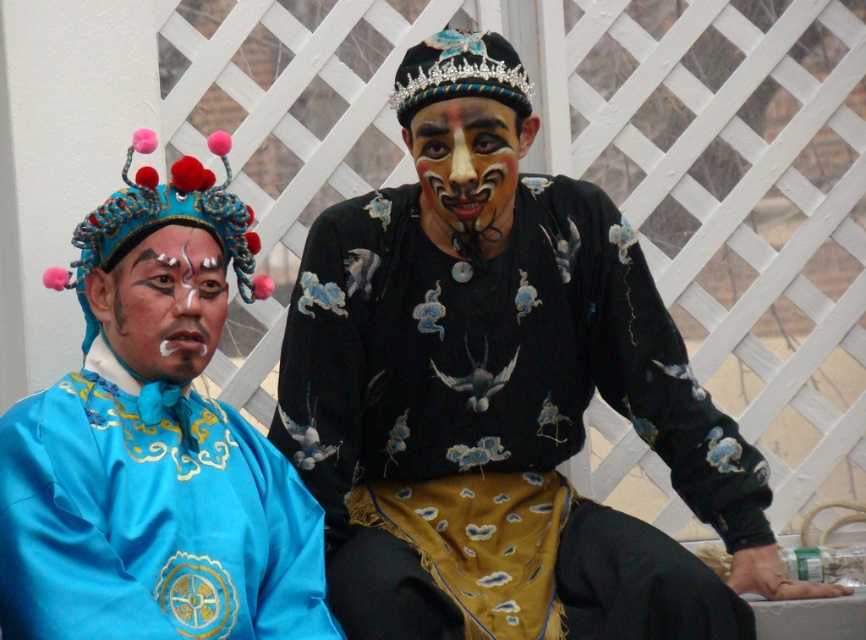
Based on the photo, measure the distance between satin blue robe at left and blue fabric/cloth crown at upper left.

satin blue robe at left and blue fabric/cloth crown at upper left are 1.78 meters apart.

Is point (159, 531) more distant than point (251, 282)?

No, it is not.

Find the location of a particular element. satin blue robe at left is located at coordinates (154, 445).

Is satin blue robe at left smaller than matte blue face at left?

Correct, satin blue robe at left occupies less space than matte blue face at left.

Does satin blue robe at left have a lesser width compared to matte blue face at left?

Indeed, satin blue robe at left has a lesser width compared to matte blue face at left.

This screenshot has width=866, height=640. Identify the location of satin blue robe at left. (154, 445).

Where is `satin blue robe at left`? satin blue robe at left is located at coordinates (154, 445).

Is satin blue robe at left in front of painted face at center?

Yes, it is in front of painted face at center.

Which is behind, point (83, 442) or point (499, 115)?

The point (499, 115) is more distant.

The width and height of the screenshot is (866, 640). What are the coordinates of `satin blue robe at left` in the screenshot? It's located at [x=154, y=445].